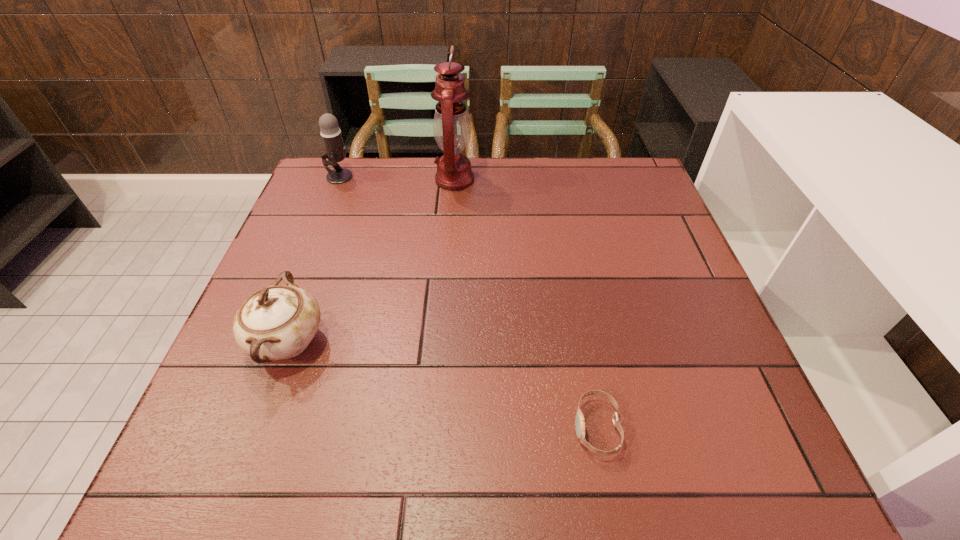
Find the location of a particular element. vacant region at the near edge of the desktop is located at coordinates (290, 454).

At what (x,y) coordinates should I click in order to perform the action: click on vacant space at the left edge of the desktop. Please return your answer as a coordinate pair (x, y). Looking at the image, I should click on (231, 386).

In the image, there is a desktop. Where is `blank space at the right edge`? blank space at the right edge is located at coordinates (736, 386).

I want to click on vacant area at the far right corner of the desktop, so click(626, 180).

Image resolution: width=960 pixels, height=540 pixels. What are the coordinates of `empty space that is in between the oil lamp and the nearest object` in the screenshot? It's located at (526, 303).

Locate an element on the screen. The width and height of the screenshot is (960, 540). empty location between the third shortest object and the watch is located at coordinates (468, 302).

At what (x,y) coordinates should I click in order to perform the action: click on empty location between the watch and the microphone. Please return your answer as a coordinate pair (x, y). Looking at the image, I should click on (468, 302).

The height and width of the screenshot is (540, 960). Find the location of `free space between the second nearest object and the rightmost object`. free space between the second nearest object and the rightmost object is located at coordinates pyautogui.click(x=443, y=384).

At what (x,y) coordinates should I click in order to perform the action: click on free space between the third farthest object and the tallest object. Please return your answer as a coordinate pair (x, y). The width and height of the screenshot is (960, 540). Looking at the image, I should click on (372, 261).

Image resolution: width=960 pixels, height=540 pixels. I want to click on free space that is in between the third tallest object and the rightmost object, so click(x=443, y=384).